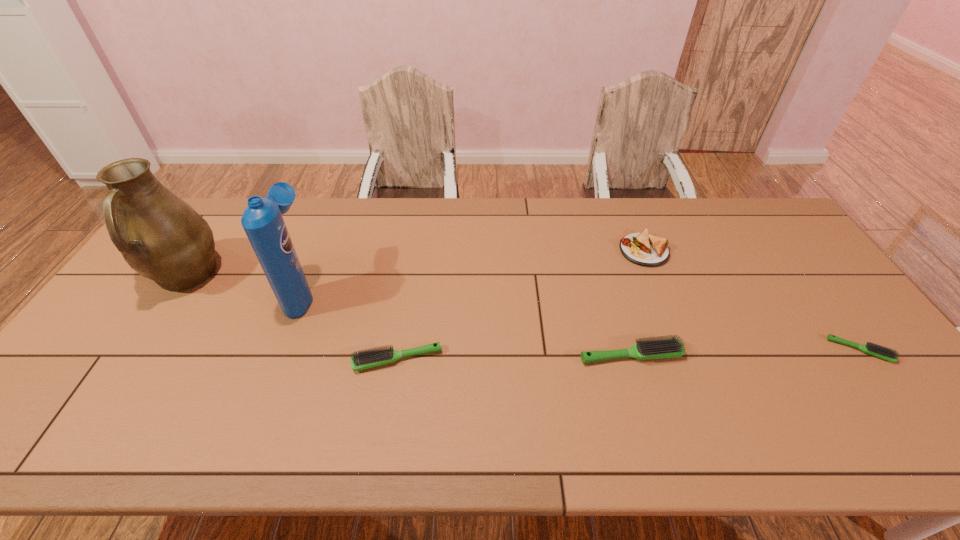
You are a GUI agent. You are given a task and a screenshot of the screen. Output one action in this format:
    pyautogui.click(x=<x>, y=<y>)
    Task: Click on the vacant space in between the sandwich and the fourth object from right to left
    
    Given the screenshot: What is the action you would take?
    pyautogui.click(x=520, y=305)

The image size is (960, 540). Identify the location of vacant space in between the fourth object from right to left and the fifth object from right to left. pyautogui.click(x=350, y=326).

Find the location of a particular element. vacant point located between the leftmost object and the shortest hairbrush is located at coordinates [523, 313].

The width and height of the screenshot is (960, 540). Identify the location of object that stands as the closest to the leftmost object. (262, 220).

Locate which object ranks fifth in proximity to the second hairbrush from left to right. Please provide its 2D coordinates. Your answer should be formatted as a tuple, i.e. [(x, y)], where the tuple contains the x and y coordinates of a point satisfying the conditions above.

[(160, 236)]

At what (x,y) coordinates should I click in order to perform the action: click on hairbrush that stands as the closest to the sandwich. Please return your answer as a coordinate pair (x, y). This screenshot has height=540, width=960. Looking at the image, I should click on (662, 348).

Find the location of a particular element. The image size is (960, 540). hairbrush that is the nearest to the fifth object from right to left is located at coordinates [x=372, y=357].

This screenshot has height=540, width=960. Find the location of `vacant area in the image that satisfies the following two spatial constraints: 1. on the back side of the sandwich; 2. on the right side of the fifth object from right to left`. vacant area in the image that satisfies the following two spatial constraints: 1. on the back side of the sandwich; 2. on the right side of the fifth object from right to left is located at coordinates (319, 251).

Find the location of `vacant space that satisfies the following two spatial constraints: 1. on the front side of the shortest hairbrush; 2. on the left side of the sandwich`. vacant space that satisfies the following two spatial constraints: 1. on the front side of the shortest hairbrush; 2. on the left side of the sandwich is located at coordinates (683, 350).

The width and height of the screenshot is (960, 540). I want to click on blank area in the image that satisfies the following two spatial constraints: 1. on the handle side of the rightmost hairbrush; 2. on the left side of the leftmost object, so click(136, 350).